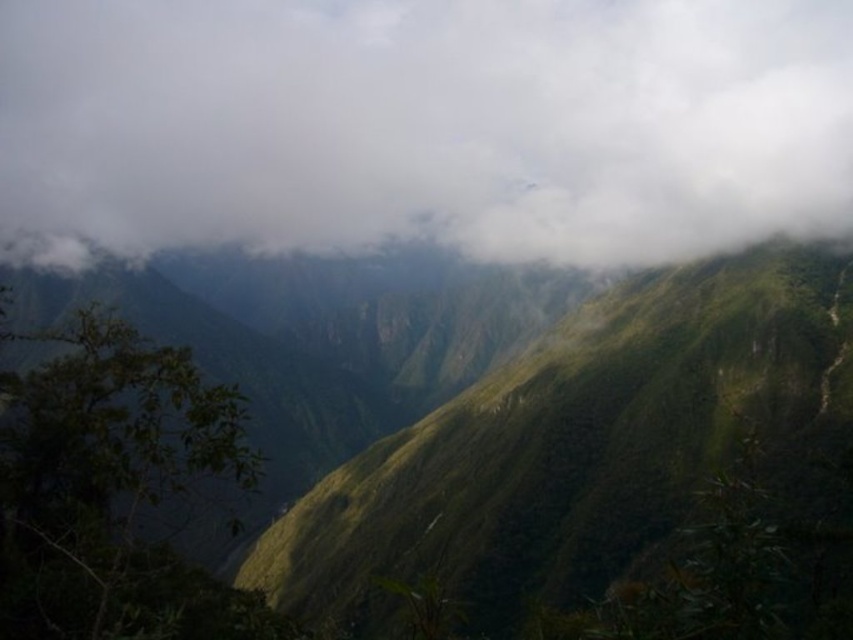
Question: Which object is closer to the camera taking this photo?

Choices:
 (A) white fluffy cloud at upper center
 (B) green grassy hillside at center

Answer: (B)

Question: Is white fluffy cloud at upper center wider than green grassy hillside at center?

Choices:
 (A) no
 (B) yes

Answer: (B)

Question: Is white fluffy cloud at upper center above green grassy hillside at center?

Choices:
 (A) no
 (B) yes

Answer: (B)

Question: Which point is closer to the camera?

Choices:
 (A) white fluffy cloud at upper center
 (B) green grassy hillside at center

Answer: (B)

Question: Does white fluffy cloud at upper center lie behind green grassy hillside at center?

Choices:
 (A) yes
 (B) no

Answer: (A)